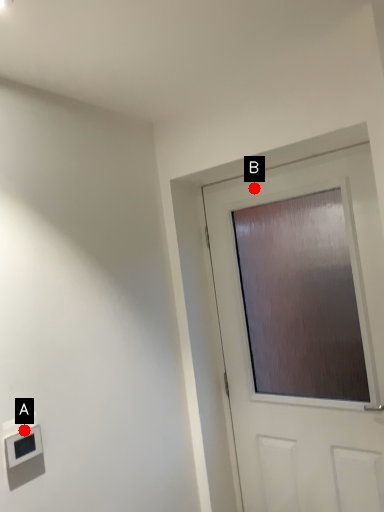
Question: Two points are circled on the image, labeled by A and B beside each circle. Which point is closer to the camera taking this photo?

Choices:
 (A) A is closer
 (B) B is closer

Answer: (A)